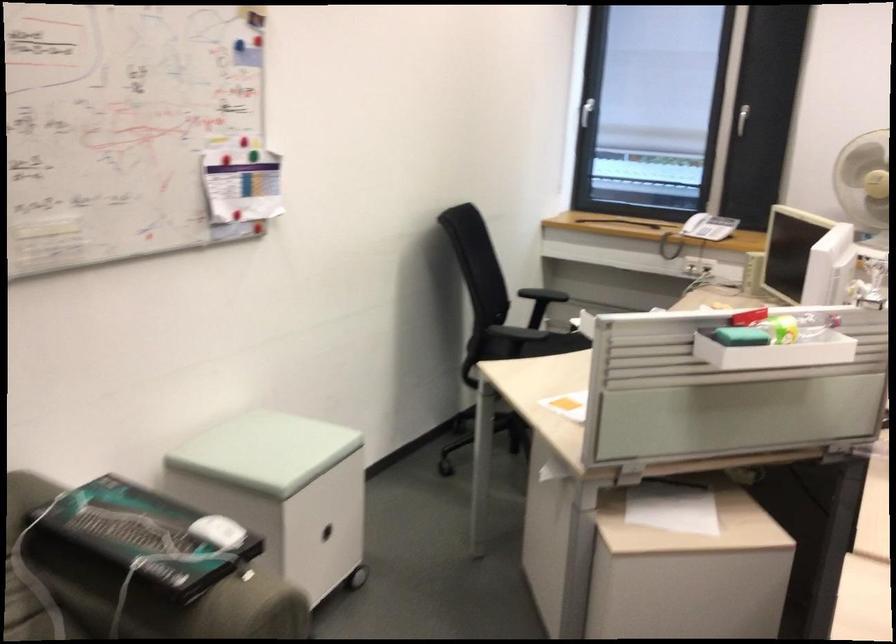
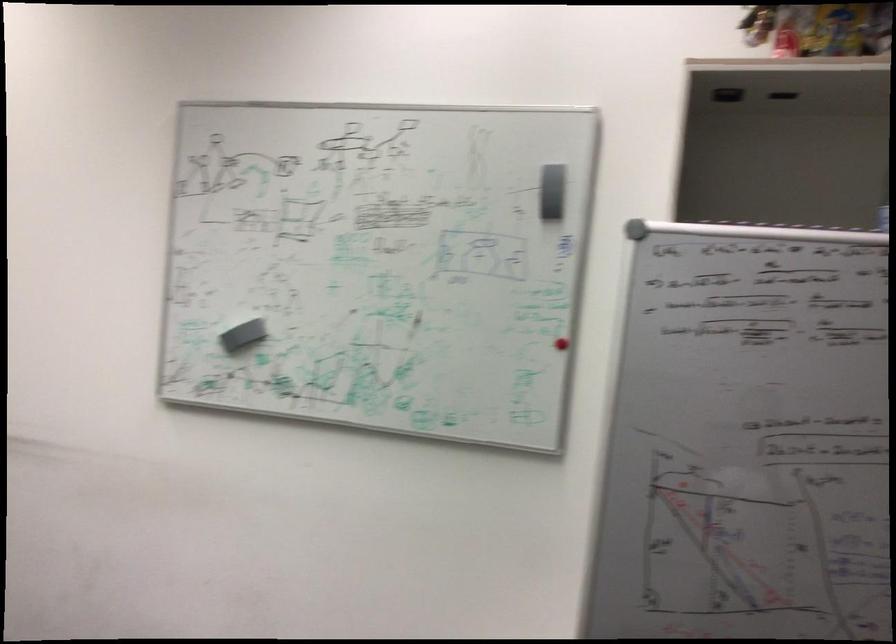
Question: The first image is from the beginning of the video and the second image is from the end. How did the camera likely rotate when shooting the video?

Choices:
 (A) Left
 (B) Right
 (C) Up
 (D) Down

Answer: (B)